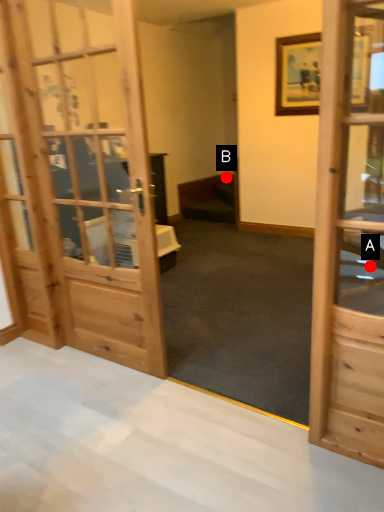
Question: Two points are circled on the image, labeled by A and B beside each circle. Which of the following is the closest to the observer?

Choices:
 (A) A is closer
 (B) B is closer

Answer: (A)